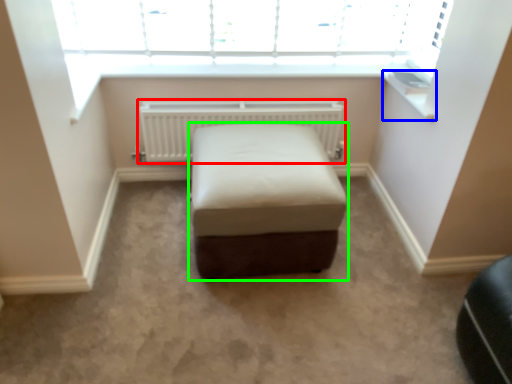
Question: Which object is the closest to the radiator (highlighted by a red box)? Choose among these: window sill (highlighted by a blue box) or furniture (highlighted by a green box).

Choices:
 (A) window sill
 (B) furniture

Answer: (B)